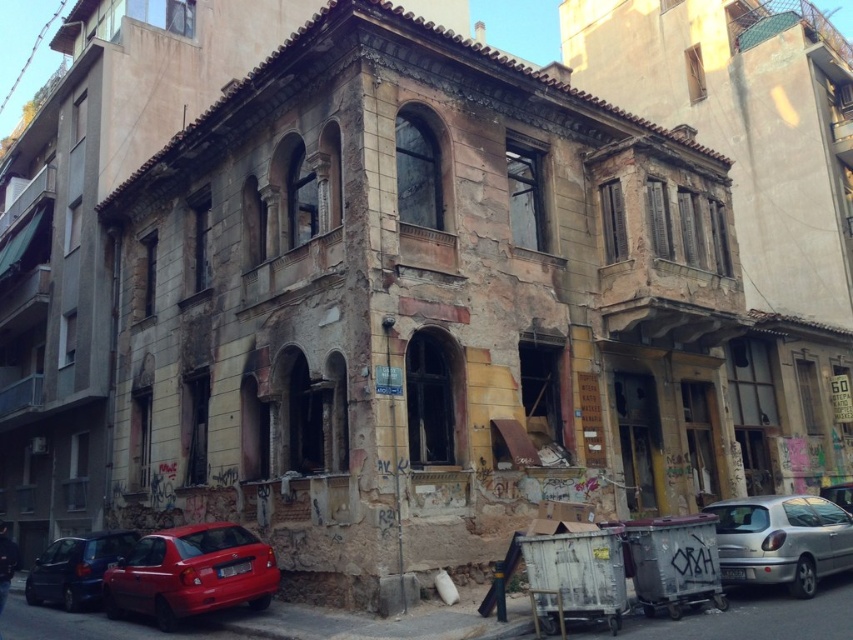
Who is shorter, shiny red hatchback at lower left or silver metallic car at lower right?

With less height is silver metallic car at lower right.

Does shiny red hatchback at lower left have a greater height compared to silver metallic car at lower right?

Yes.

Between point (256, 541) and point (798, 509), which one is positioned in front?

Point (798, 509) is more forward.

Locate an element on the screen. Image resolution: width=853 pixels, height=640 pixels. shiny red hatchback at lower left is located at coordinates (190, 573).

Is point (242, 563) in front of point (96, 593)?

Yes, point (242, 563) is in front of point (96, 593).

Which of these two, shiny red hatchback at lower left or matte red car at lower left, stands shorter?

Standing shorter between the two is matte red car at lower left.

The height and width of the screenshot is (640, 853). In order to click on shiny red hatchback at lower left in this screenshot , I will do `click(190, 573)`.

Does silver metallic car at lower right have a greater width compared to matte red car at lower left?

Yes.

Can you confirm if silver metallic car at lower right is smaller than matte red car at lower left?

Yes.

Between point (728, 548) and point (128, 531), which one is positioned behind?

Point (128, 531)

Identify the location of silver metallic car at lower right. This screenshot has width=853, height=640. (781, 540).